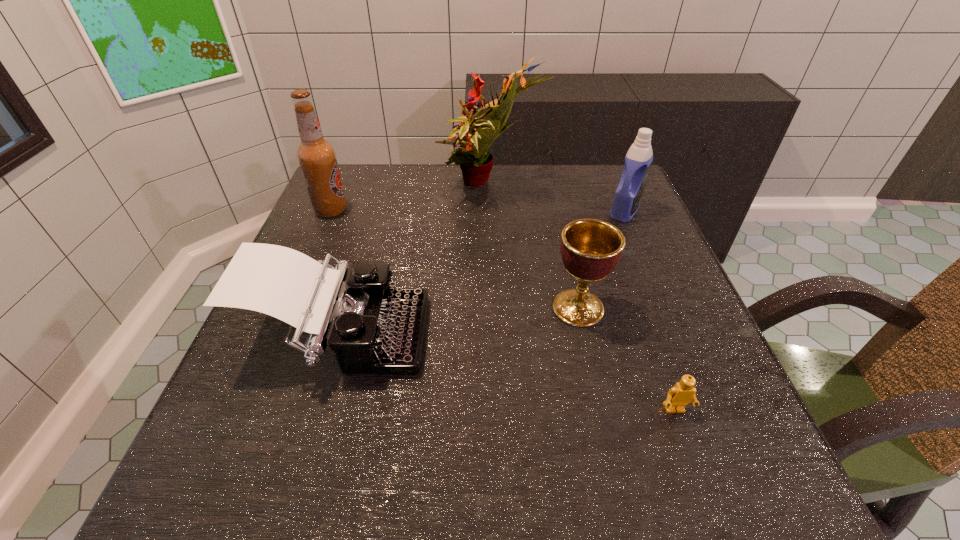
Locate an element on the screen. The height and width of the screenshot is (540, 960). vacant region between the chalice and the typewriter is located at coordinates (459, 322).

Find the location of `empty location between the chalice and the typewriter`. empty location between the chalice and the typewriter is located at coordinates (459, 322).

Identify the location of blank region between the detergent and the bouquet. The width and height of the screenshot is (960, 540). (558, 199).

Where is `empty space between the beer bottle and the chalice`? Image resolution: width=960 pixels, height=540 pixels. empty space between the beer bottle and the chalice is located at coordinates (455, 259).

In order to click on free space between the beer bottle and the detergent in this screenshot , I will do `click(478, 211)`.

The image size is (960, 540). I want to click on free space that is in between the typewriter and the bouquet, so click(x=415, y=262).

This screenshot has height=540, width=960. In order to click on free space between the bouquet and the detergent in this screenshot , I will do `click(558, 199)`.

I want to click on vacant point located between the beer bottle and the nearest object, so click(x=503, y=310).

The width and height of the screenshot is (960, 540). Identify the location of object that can be found as the second closest to the shortest object. (373, 328).

Locate which object ranks in proximity to the detergent. Please provide its 2D coordinates. Your answer should be formatted as a tuple, i.e. [(x, y)], where the tuple contains the x and y coordinates of a point satisfying the conditions above.

[(475, 162)]